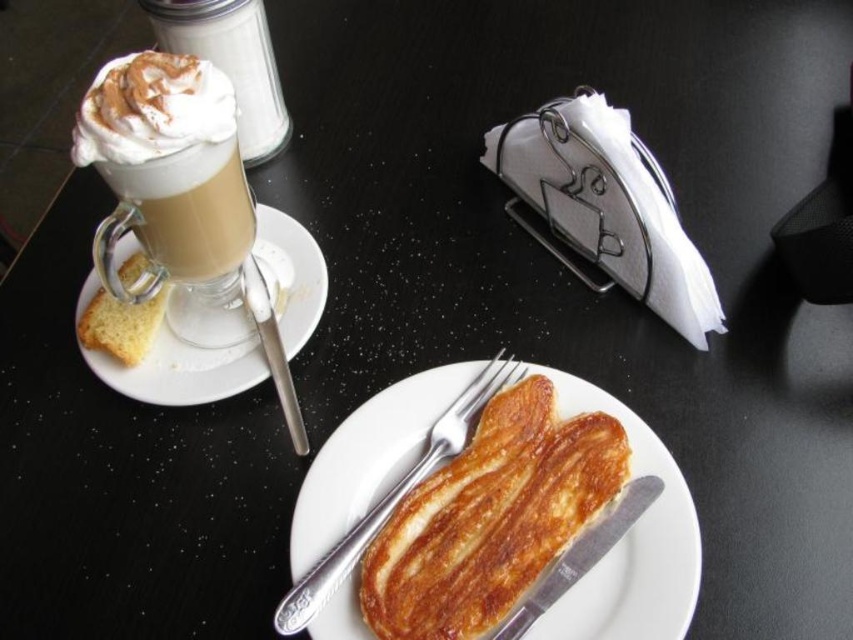
Question: Which of the following is the farthest from the observer?

Choices:
 (A) yellowish matte bread at left
 (B) satin silver knife at upper left
 (C) white ceramic saucer at left

Answer: (A)

Question: Considering the relative positions of matte glass cup at upper left and satin silver knife at upper left in the image provided, where is matte glass cup at upper left located with respect to satin silver knife at upper left?

Choices:
 (A) below
 (B) above

Answer: (B)

Question: Can you confirm if silver metallic knife at lower center is positioned above yellowish matte bread at left?

Choices:
 (A) yes
 (B) no

Answer: (B)

Question: Observing the image, what is the correct spatial positioning of golden-brown toasted bread at center in reference to yellowish matte bread at left?

Choices:
 (A) above
 (B) below

Answer: (B)

Question: Which point is farther to the camera?

Choices:
 (A) white ceramic saucer at left
 (B) satin silver knife at upper left
 (C) matte glass cup at upper left

Answer: (A)

Question: Considering the real-world distances, which object is farthest from the white ceramic saucer at left?

Choices:
 (A) golden-brown toasted bread at center
 (B) satin silver knife at upper left

Answer: (A)